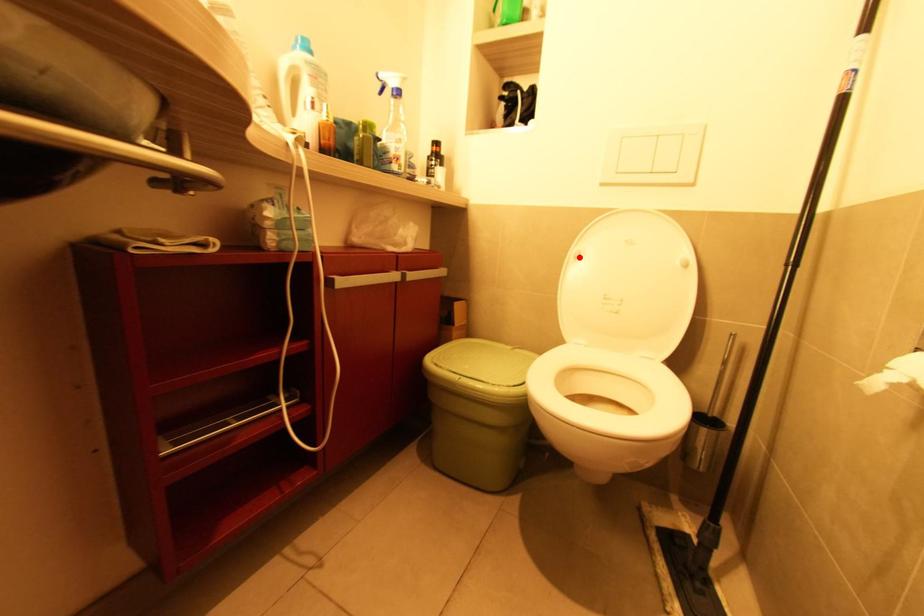
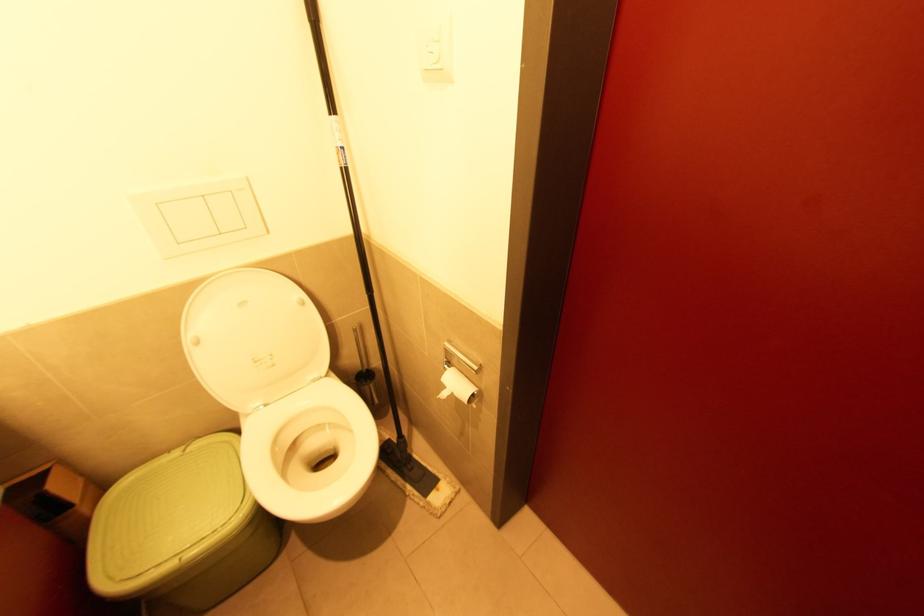
Question: I am providing you with two images of the same scene from different viewpoints. A red point is marked on the first image. Is the red point's position out of view in image 2?

Choices:
 (A) Yes
 (B) No

Answer: (B)